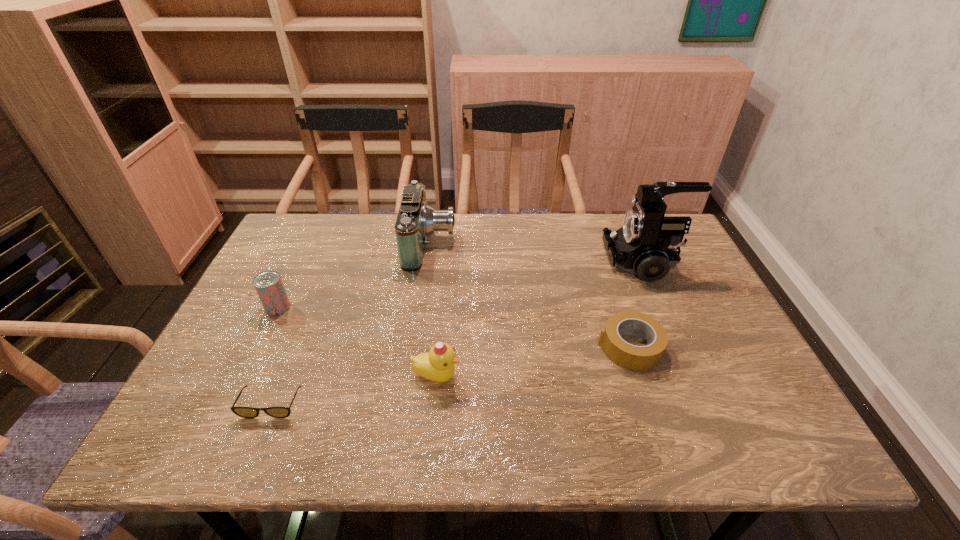
Where is `beer can that is at the left edge`? beer can that is at the left edge is located at coordinates (268, 284).

At what (x,y) coordinates should I click in order to perform the action: click on sunglasses that is at the left edge. Please return your answer as a coordinate pair (x, y). Looking at the image, I should click on (245, 412).

Find the location of a particular element. Image resolution: width=960 pixels, height=540 pixels. object that is positioned at the right edge is located at coordinates (646, 244).

Find the location of `object that is positioned at the near left corner`. object that is positioned at the near left corner is located at coordinates click(245, 412).

At what (x,y) coordinates should I click in order to perform the action: click on object positioned at the far right corner. Please return your answer as a coordinate pair (x, y). Looking at the image, I should click on click(646, 244).

In the image, there is a desktop. Find the location of `free space at the far edge`. free space at the far edge is located at coordinates (521, 257).

Where is `vacant space at the near edge`? This screenshot has height=540, width=960. vacant space at the near edge is located at coordinates (381, 450).

Where is `free spot at the left edge of the desktop`? Image resolution: width=960 pixels, height=540 pixels. free spot at the left edge of the desktop is located at coordinates (259, 373).

At what (x,y) coordinates should I click in order to perform the action: click on free space at the far left corner. Please return your answer as a coordinate pair (x, y). This screenshot has width=960, height=540. Looking at the image, I should click on (277, 244).

What are the coordinates of `vacant area between the fifth shortest object and the fourth nearest object` in the screenshot? It's located at coord(354,275).